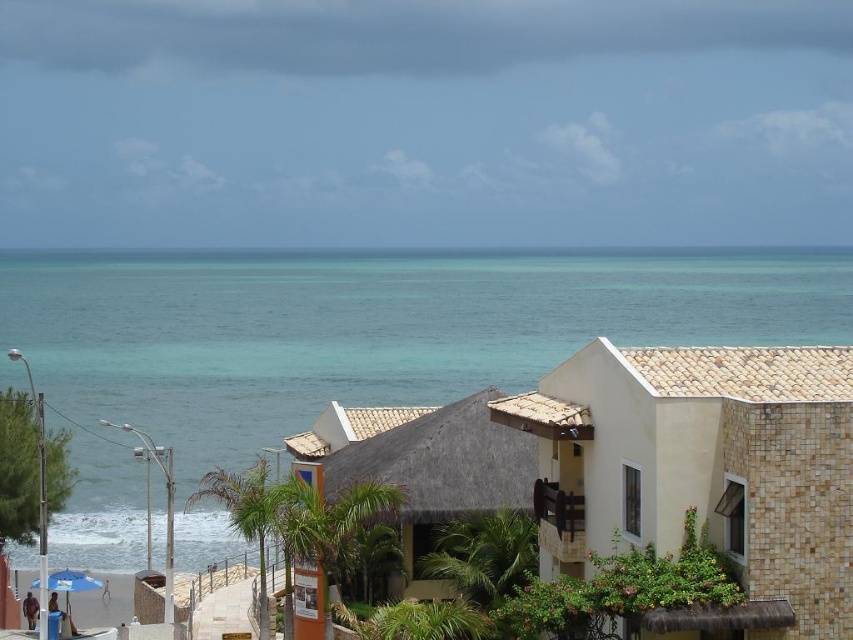
Question: Does beige tile house at right appear over thatched roof hut at center?

Choices:
 (A) yes
 (B) no

Answer: (A)

Question: Which of the following is the farthest from the observer?

Choices:
 (A) (426, 413)
 (B) (273, 266)

Answer: (B)

Question: Can you confirm if turquoise water at center is positioned below beige tile house at right?

Choices:
 (A) no
 (B) yes

Answer: (A)

Question: Which object is positioned farthest from the turquoise water at center?

Choices:
 (A) thatched roof hut at center
 (B) beige tile house at right

Answer: (A)

Question: Is beige tile house at right positioned behind thatched roof hut at center?

Choices:
 (A) yes
 (B) no

Answer: (B)

Question: Which object appears farthest from the camera in this image?

Choices:
 (A) turquoise water at center
 (B) beige tile house at right

Answer: (A)